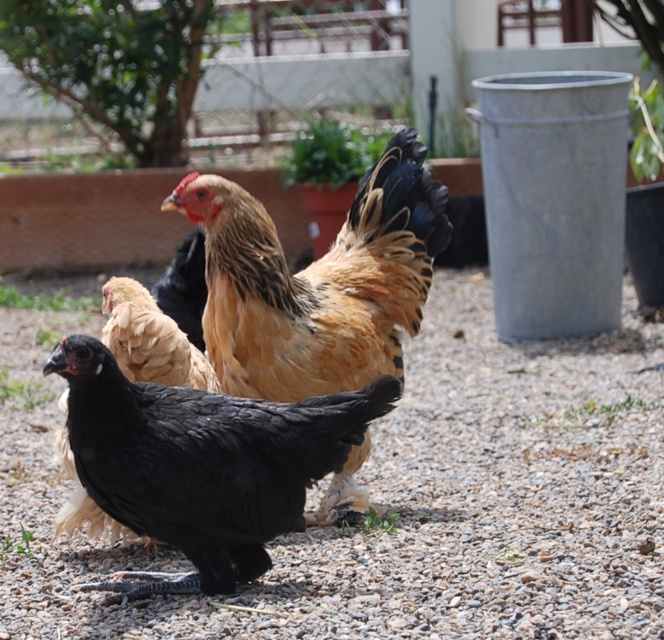
Question: Among these points, which one is nearest to the camera?

Choices:
 (A) (424, 193)
 (B) (236, 404)
 (C) (378, 461)

Answer: (B)

Question: Which point is closer to the camera?

Choices:
 (A) gray gravel at center
 (B) black matte chicken at lower left
 (C) golden-brown feathered chicken at center

Answer: (B)

Question: Which of the following is the closest to the observer?

Choices:
 (A) gray gravel at center
 (B) black matte chicken at lower left

Answer: (B)

Question: Where is black matte chicken at lower left located in relation to golden-brown feathered chicken at center in the image?

Choices:
 (A) right
 (B) left

Answer: (B)

Question: From the image, what is the correct spatial relationship of black matte chicken at lower left in relation to golden-brown feathered chicken at center?

Choices:
 (A) right
 (B) left

Answer: (B)

Question: Is gray gravel at center smaller than black matte chicken at lower left?

Choices:
 (A) no
 (B) yes

Answer: (A)